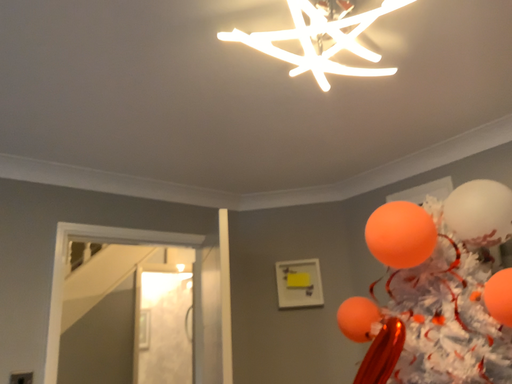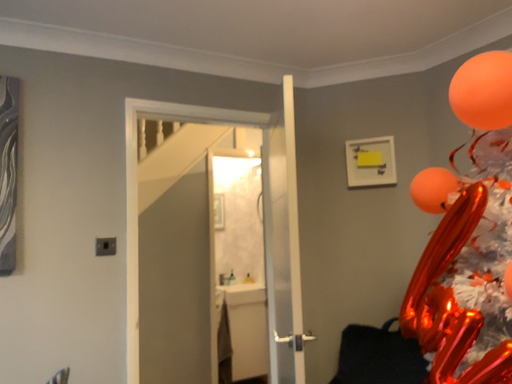
Question: How did the camera likely rotate when shooting the video?

Choices:
 (A) rotated left
 (B) rotated right

Answer: (A)